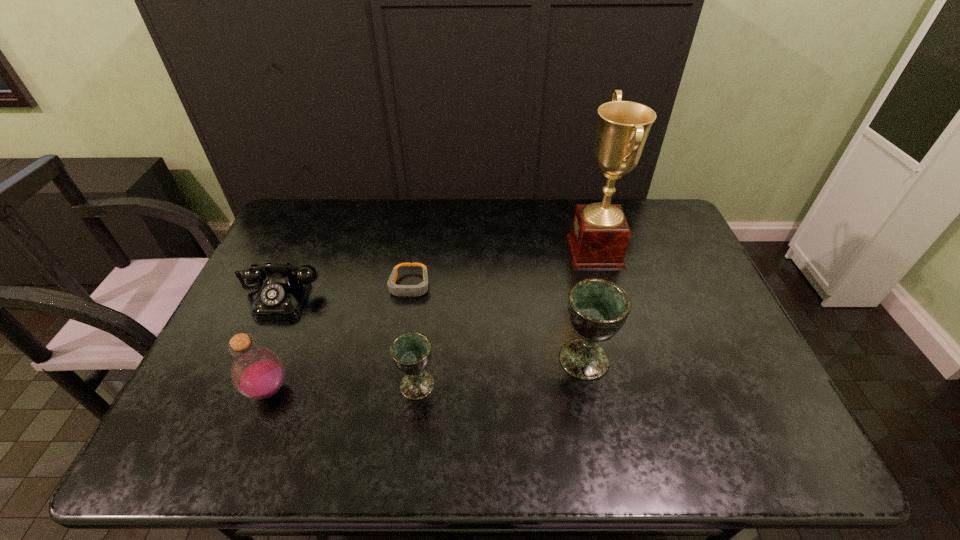
In order to click on free location located 0.290m on the plaque of the tallest object in this screenshot , I will do `click(481, 252)`.

Find the location of a particular element. The height and width of the screenshot is (540, 960). vacant point located 0.100m on the plaque of the tallest object is located at coordinates (540, 252).

Image resolution: width=960 pixels, height=540 pixels. I want to click on free location located 0.050m on the dial of the telephone, so click(264, 335).

You are a GUI agent. You are given a task and a screenshot of the screen. Output one action in this format:
    pyautogui.click(x=<x>, y=<y>)
    Task: Click on the free space located 0.180m on the front and back of the goggles
    This screenshot has height=540, width=960.
    Given the screenshot: What is the action you would take?
    pyautogui.click(x=399, y=353)

You are a GUI agent. You are given a task and a screenshot of the screen. Output one action in this format:
    pyautogui.click(x=<x>, y=<y>)
    Task: Click on the vacant space located on the left of the bottle
    
    Given the screenshot: What is the action you would take?
    coord(216,390)

This screenshot has width=960, height=540. I want to click on object located in the far edge section of the desktop, so 599,237.

I want to click on chalice that is at the near edge, so click(x=411, y=352).

Find the location of `bottle located in the near edge section of the desktop`. bottle located in the near edge section of the desktop is located at coordinates (257, 373).

Locate an element on the screen. The height and width of the screenshot is (540, 960). telephone that is at the left edge is located at coordinates (281, 297).

Where is `bottle that is at the left edge`? bottle that is at the left edge is located at coordinates (257, 373).